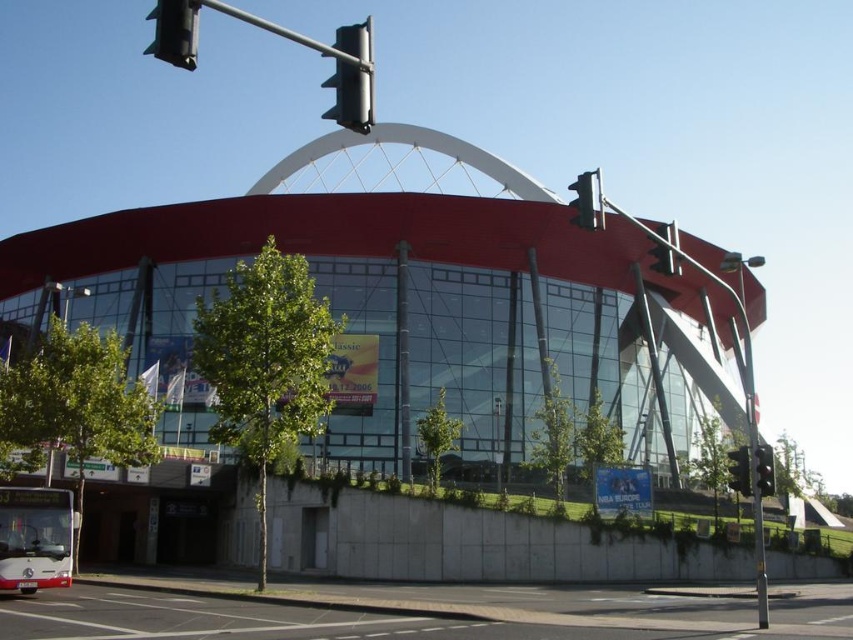
Question: Considering the real-world distances, which object is farthest from the metallic at upper right?

Choices:
 (A) green glass traffic light at right
 (B) metallic gray traffic light at upper center

Answer: (B)

Question: Is black plastic traffic light at upper left below black plastic traffic light at upper center?

Choices:
 (A) yes
 (B) no

Answer: (B)

Question: Which of the following is the closest to the observer?

Choices:
 (A) metallic gray traffic light at upper center
 (B) black plastic traffic light at upper left
 (C) white matte bus at lower left
 (D) green glass traffic light at right

Answer: (B)

Question: Can you confirm if metallic gray traffic light at upper center is thinner than black plastic traffic light at upper center?

Choices:
 (A) yes
 (B) no

Answer: (A)

Question: Based on their relative distances, which object is nearer to the metallic gray traffic light at upper center?

Choices:
 (A) green glass traffic light at right
 (B) black plastic traffic light at upper center
 (C) metallic at upper right
 (D) black plastic traffic light at upper left

Answer: (D)

Question: Is white matte bus at lower left thinner than black plastic traffic light at upper center?

Choices:
 (A) yes
 (B) no

Answer: (A)